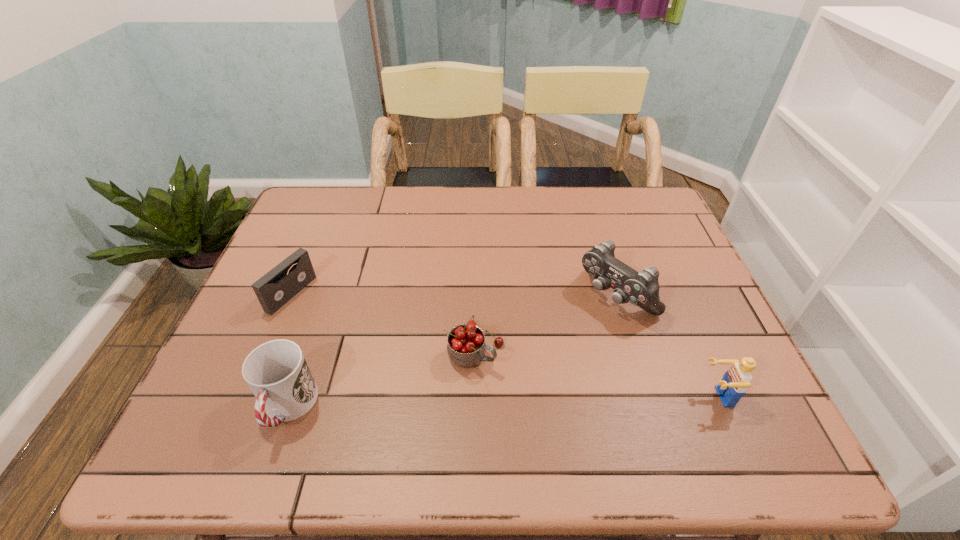
You are a GUI agent. You are given a task and a screenshot of the screen. Output one action in this format:
    pyautogui.click(x=<x>, y=<y>)
    Task: Click on the free space located 0.350m on the surface of the fourth object from left to right with buttons
    The width and height of the screenshot is (960, 540).
    Given the screenshot: What is the action you would take?
    pyautogui.click(x=483, y=399)

I want to click on vacant space located on the handle side of the pot filled with cherries, so click(558, 399).

Find the location of `vacant region located 0.110m on the handle side of the pot filled with cherries`. vacant region located 0.110m on the handle side of the pot filled with cherries is located at coordinates coord(544,392).

At what (x,y) coordinates should I click in order to perform the action: click on vacant space located 0.050m on the front-facing side of the shortest object. Please return your answer as a coordinate pair (x, y). Looking at the image, I should click on tap(319, 312).

Image resolution: width=960 pixels, height=540 pixels. Find the location of `vacant area situated 0.400m on the front-facing side of the shortest object`. vacant area situated 0.400m on the front-facing side of the shortest object is located at coordinates (441, 370).

This screenshot has width=960, height=540. Find the location of `vacant space located 0.350m on the front-facing side of the shortest object`. vacant space located 0.350m on the front-facing side of the shortest object is located at coordinates (421, 361).

You are a GUI agent. You are given a task and a screenshot of the screen. Output one action in this format:
    pyautogui.click(x=<x>, y=<y>)
    Task: Click on the cup located in the near edge section of the desktop
    
    Given the screenshot: What is the action you would take?
    pyautogui.click(x=277, y=373)

Where is `Lego present at the near edge`? This screenshot has height=540, width=960. Lego present at the near edge is located at coordinates (737, 379).

In order to click on pot filled with cherries situated at the near edge in this screenshot , I will do `click(466, 347)`.

Where is `cup situated at the left edge`? cup situated at the left edge is located at coordinates (277, 373).